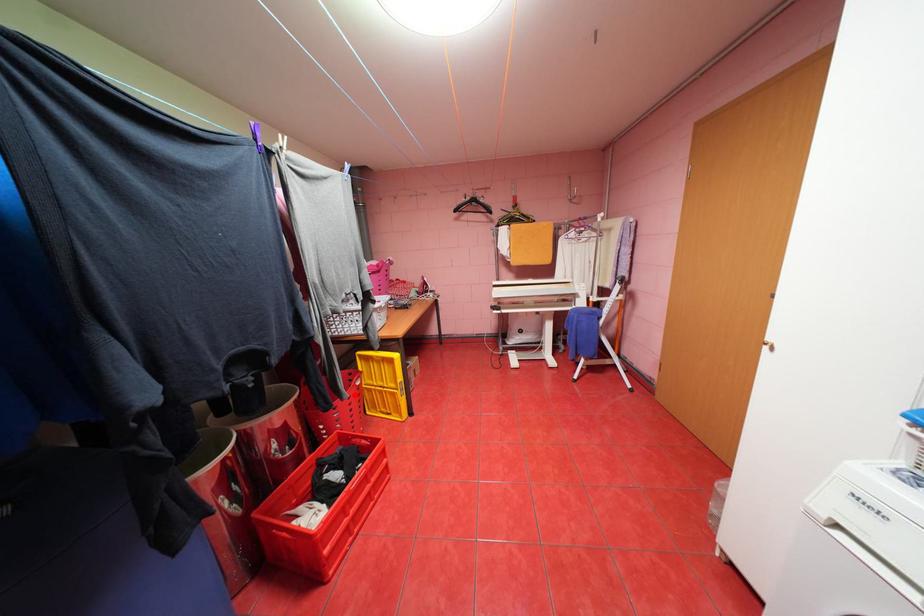
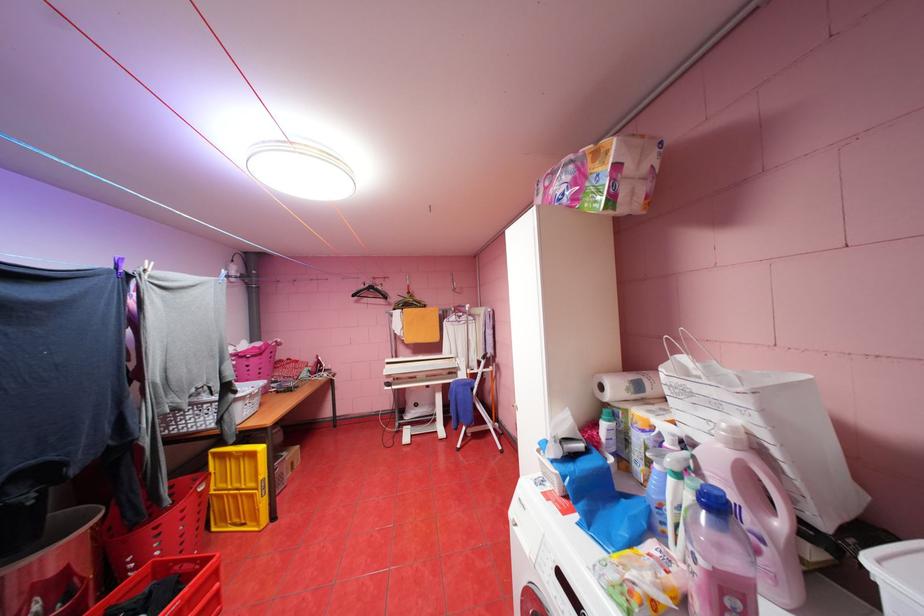
In the second image, find the point that corresponds to the highlighted location in the first image.

(176, 501)